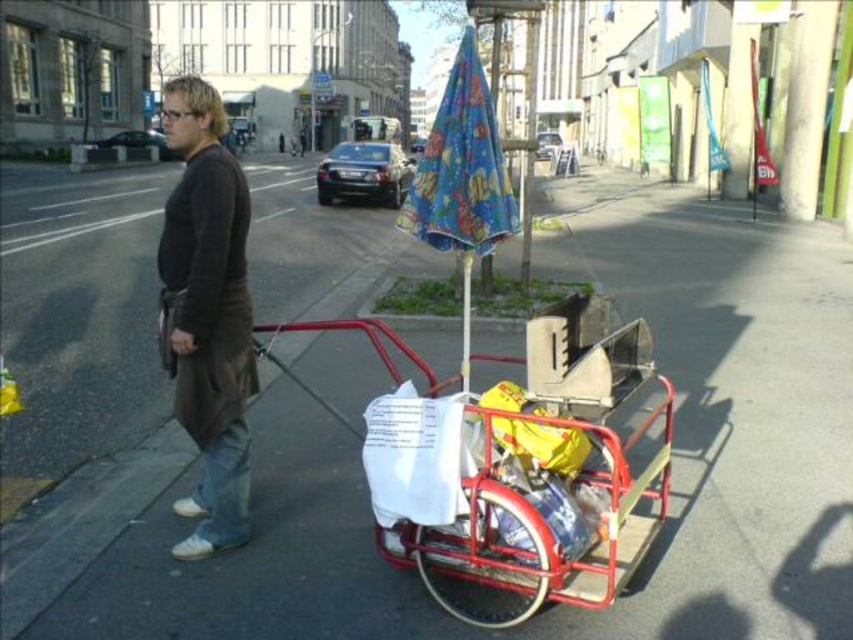
Between point (375, 401) and point (236, 241), which one is positioned in front?

Point (375, 401) is more forward.

Where is `metallic red trolley at center`? The height and width of the screenshot is (640, 853). metallic red trolley at center is located at coordinates (514, 476).

Consider the image. Can you confirm if metallic red trolley at center is wider than blue printed fabric umbrella at center?

Yes, metallic red trolley at center is wider than blue printed fabric umbrella at center.

Does metallic red trolley at center appear on the left side of blue printed fabric umbrella at center?

No, metallic red trolley at center is not to the left of blue printed fabric umbrella at center.

You are a GUI agent. You are given a task and a screenshot of the screen. Output one action in this format:
    pyautogui.click(x=<x>, y=<y>)
    Task: Click on the metallic red trolley at center
    Image resolution: width=853 pixels, height=640 pixels.
    Given the screenshot: What is the action you would take?
    pyautogui.click(x=514, y=476)

Is point (209, 340) in front of point (445, 220)?

Yes.

Is brown matte jacket at left thinner than blue printed fabric umbrella at center?

Incorrect, brown matte jacket at left's width is not less than blue printed fabric umbrella at center's.

Which is behind, point (181, 224) or point (474, 170)?

The point (474, 170) is more distant.

Where is `brown matte jacket at left`? brown matte jacket at left is located at coordinates (207, 312).